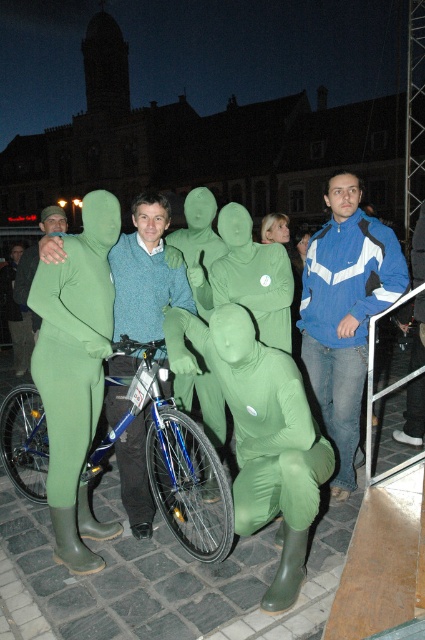
Question: Is the position of blue metallic bicycle at center less distant than that of knitted sweater at center?

Choices:
 (A) yes
 (B) no

Answer: (A)

Question: Which of these objects is positioned farthest from the green matte suit at center?

Choices:
 (A) blue/white jacket at right
 (B) green rubber suit at left

Answer: (A)

Question: Does blue metallic bicycle at center lie in front of knitted sweater at center?

Choices:
 (A) no
 (B) yes

Answer: (B)

Question: Is blue/white jacket at right to the left of green rubber suit at left from the viewer's perspective?

Choices:
 (A) no
 (B) yes

Answer: (A)

Question: Which point is farther to the camera?

Choices:
 (A) blue metallic bicycle at center
 (B) knitted sweater at center
 (C) green rubber suit at left

Answer: (B)

Question: Among these objects, which one is nearest to the camera?

Choices:
 (A) green rubber suit at left
 (B) blue/white jacket at right
 (C) blue metallic bicycle at center
 (D) green matte suit at center

Answer: (D)